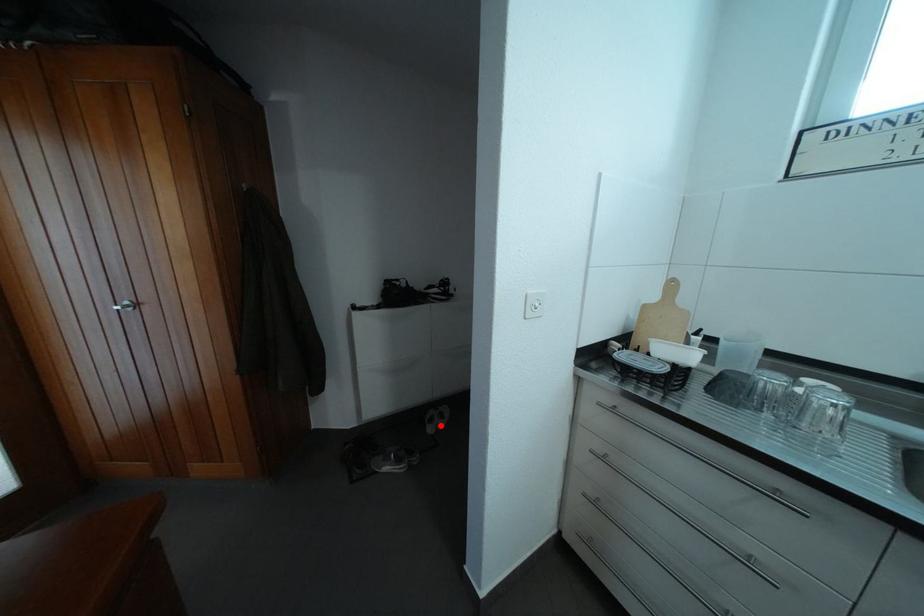
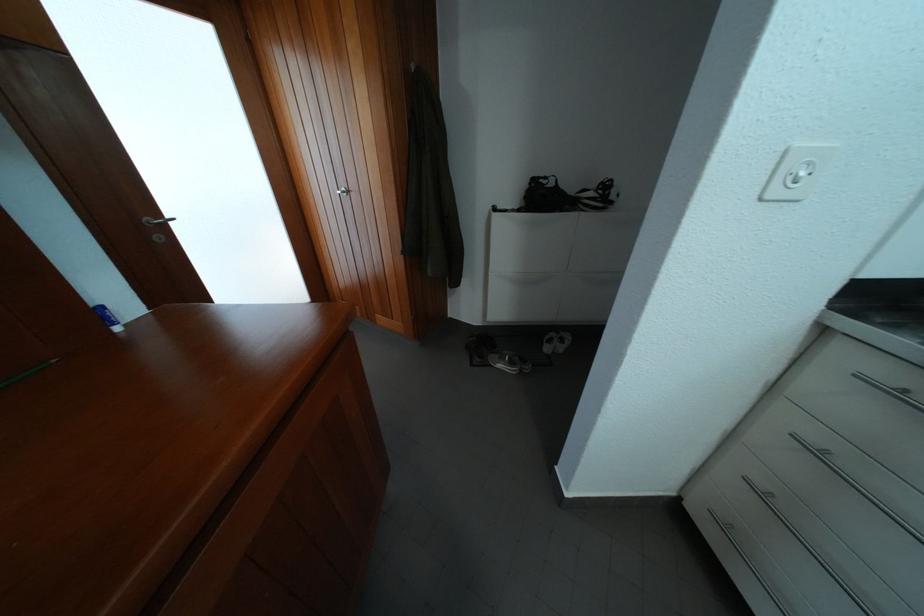
Question: I am providing you with two images of the same scene from different viewpoints. A red point is shown in image1. For the corresponding object point in image2, is it positioned nearer or farther from the camera?

Choices:
 (A) Nearer
 (B) Farther

Answer: (A)